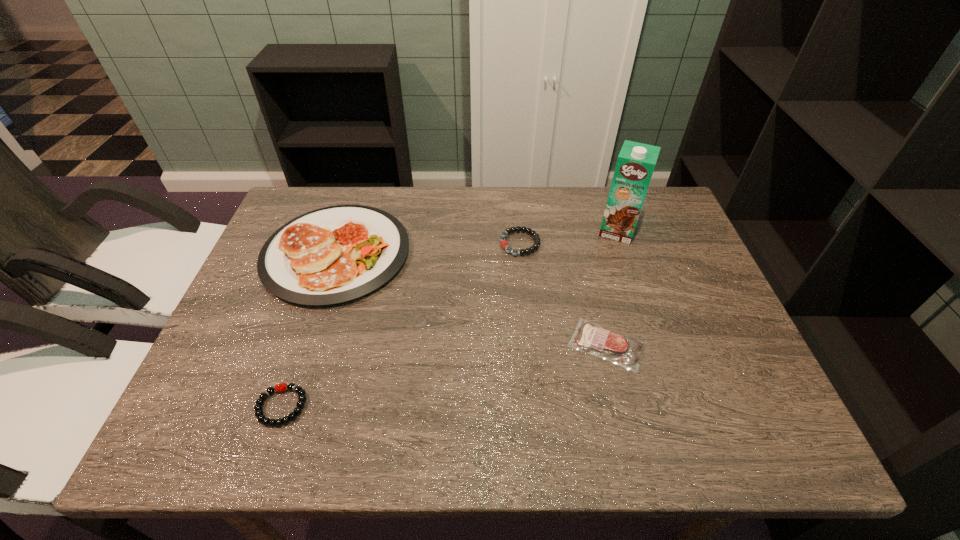
Find the location of `blank region between the tallest object and the nearest object`. blank region between the tallest object and the nearest object is located at coordinates (449, 319).

Identify the location of vacant area between the tallest object and the dish. (477, 242).

The image size is (960, 540). Find the location of `unoccupied position between the farther bracelet and the carton`. unoccupied position between the farther bracelet and the carton is located at coordinates (568, 237).

Find the location of `blank region between the third object from left to right and the dish`. blank region between the third object from left to right and the dish is located at coordinates (428, 248).

This screenshot has width=960, height=540. Find the location of `free area in between the dish and the carton`. free area in between the dish and the carton is located at coordinates tap(477, 242).

I want to click on free space between the fourth farthest object and the third object from left to right, so pyautogui.click(x=564, y=294).

Find the location of a particular element. free space between the farther bracelet and the fourth farthest object is located at coordinates (564, 294).

Image resolution: width=960 pixels, height=540 pixels. In order to click on empty space between the third object from left to right and the second nearest object in this screenshot , I will do `click(564, 294)`.

The image size is (960, 540). Find the location of `empty space that is in between the shorter bracelet and the farther bracelet`. empty space that is in between the shorter bracelet and the farther bracelet is located at coordinates pyautogui.click(x=400, y=325).

Image resolution: width=960 pixels, height=540 pixels. Identify the location of free space that is in between the steak and the dish. (471, 299).